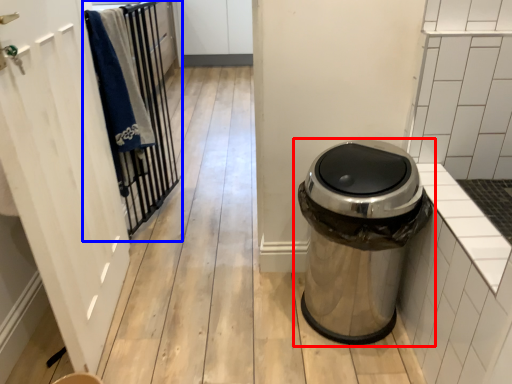
Question: Which point is further to the camera, waste container (highlighted by a red box) or closet (highlighted by a blue box)?

Choices:
 (A) waste container
 (B) closet

Answer: (B)